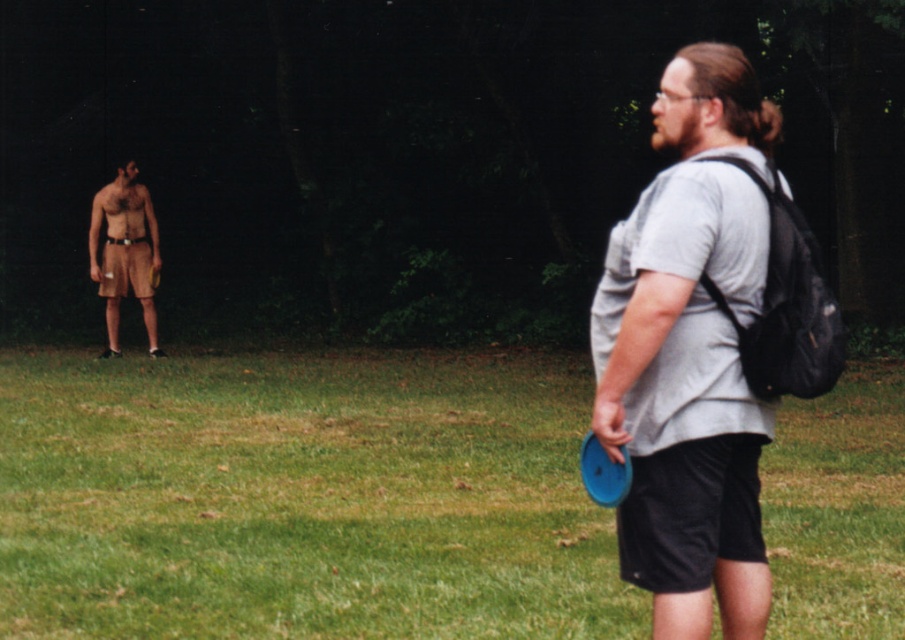
You are standing at the point marked by the coordinates point (302, 499) in the image. What is the color of the grass directly beneath your feet?

The point (302, 499) indicates green grass at center, so the grass directly beneath your feet is green.

You are a photographer trying to capture a photo of the brown fabric shorts at left and the blue plastic frisbee at right. Which object should you focus on first if you want to ensure both are in sharp focus?

The brown fabric shorts at left is much taller than the blue plastic frisbee at right, so focusing on the brown fabric shorts at left first would ensure both are in sharp focus since it is farther away.